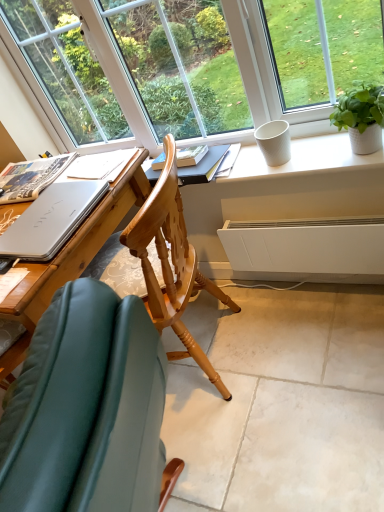
Question: Is sleek silver laptop at left looking in the opposite direction of wooden chair at center?

Choices:
 (A) no
 (B) yes

Answer: (A)

Question: Considering the relative positions of sleek silver laptop at left and wooden chair at center in the image provided, is sleek silver laptop at left to the left of wooden chair at center from the viewer's perspective?

Choices:
 (A) yes
 (B) no

Answer: (A)

Question: Is sleek silver laptop at left positioned before wooden chair at center?

Choices:
 (A) no
 (B) yes

Answer: (A)

Question: Would you say sleek silver laptop at left is a long distance from wooden chair at center?

Choices:
 (A) no
 (B) yes

Answer: (A)

Question: Considering the relative sizes of sleek silver laptop at left and wooden chair at center in the image provided, is sleek silver laptop at left taller than wooden chair at center?

Choices:
 (A) no
 (B) yes

Answer: (A)

Question: In the image, is sleek silver laptop at left on the left side or the right side of white ceramic pot at upper right?

Choices:
 (A) right
 (B) left

Answer: (B)

Question: Is sleek silver laptop at left wider or thinner than white ceramic pot at upper right?

Choices:
 (A) wide
 (B) thin

Answer: (A)

Question: Is sleek silver laptop at left spatially inside white ceramic pot at upper right, or outside of it?

Choices:
 (A) inside
 (B) outside

Answer: (B)

Question: In the image, is sleek silver laptop at left positioned in front of or behind white ceramic pot at upper right?

Choices:
 (A) behind
 (B) front

Answer: (B)

Question: Considering the positions of sleek silver laptop at left and white paper at left in the image, is sleek silver laptop at left bigger or smaller than white paper at left?

Choices:
 (A) small
 (B) big

Answer: (A)

Question: From the image's perspective, is sleek silver laptop at left located above or below white paper at left?

Choices:
 (A) below
 (B) above

Answer: (A)

Question: Considering the positions of sleek silver laptop at left and white paper at left in the image, is sleek silver laptop at left wider or thinner than white paper at left?

Choices:
 (A) thin
 (B) wide

Answer: (B)

Question: Considering the positions of sleek silver laptop at left and white paper at left in the image, is sleek silver laptop at left taller or shorter than white paper at left?

Choices:
 (A) tall
 (B) short

Answer: (B)

Question: Is point (91, 181) closer or farther from the camera than point (104, 322)?

Choices:
 (A) closer
 (B) farther

Answer: (B)

Question: Visually, is sleek silver laptop at left positioned to the left or to the right of wooden chair at center?

Choices:
 (A) left
 (B) right

Answer: (A)